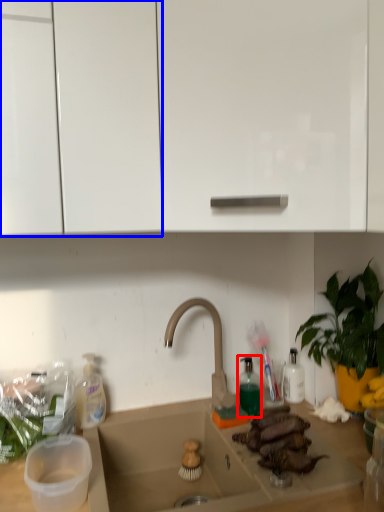
Question: Which of the following is the closest to the observer, bottle (highlighted by a red box) or cabinetry (highlighted by a blue box)?

Choices:
 (A) bottle
 (B) cabinetry

Answer: (B)